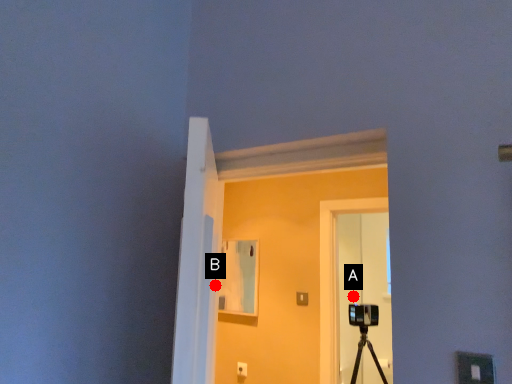
Question: Two points are circled on the image, labeled by A and B beside each circle. Which point is closer to the camera?

Choices:
 (A) A is closer
 (B) B is closer

Answer: (B)